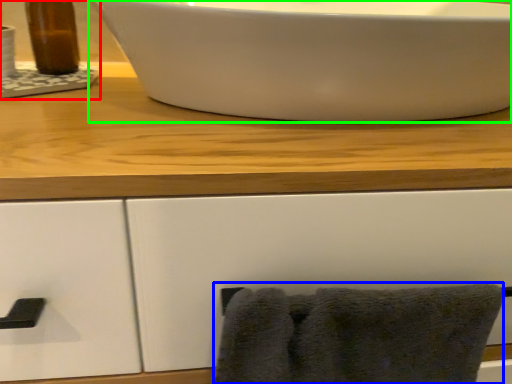
Question: Which object is the farthest from sink (highlighted by a red box)? Choose among these: bath towel (highlighted by a blue box) or sink (highlighted by a green box).

Choices:
 (A) bath towel
 (B) sink

Answer: (A)